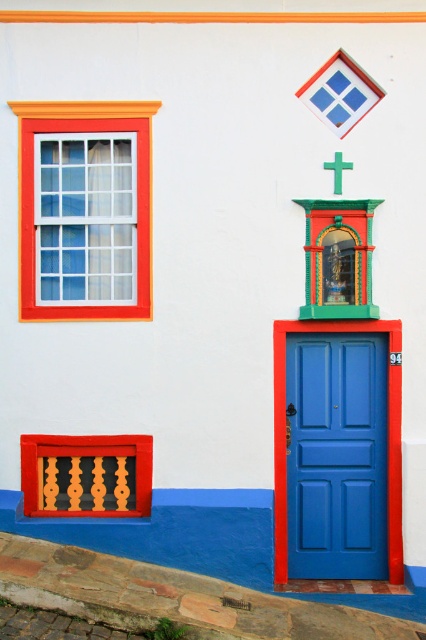
Question: Which object is the closest to the blue glossy door at right?

Choices:
 (A) orange matte window at upper left
 (B) green matte cross at upper center

Answer: (B)

Question: Is blue glossy door at right above orange matte window at upper left?

Choices:
 (A) yes
 (B) no

Answer: (B)

Question: Is blue glossy door at right closer to camera compared to orange matte window at upper left?

Choices:
 (A) no
 (B) yes

Answer: (A)

Question: Which object is positioned farthest from the green matte cross at upper center?

Choices:
 (A) orange matte window at upper left
 (B) blue glossy door at right

Answer: (B)

Question: Which object appears farthest from the camera in this image?

Choices:
 (A) green matte cross at upper center
 (B) blue glossy door at right
 (C) orange matte window at upper left

Answer: (B)

Question: Is blue glossy door at right thinner than green matte cross at upper center?

Choices:
 (A) yes
 (B) no

Answer: (B)